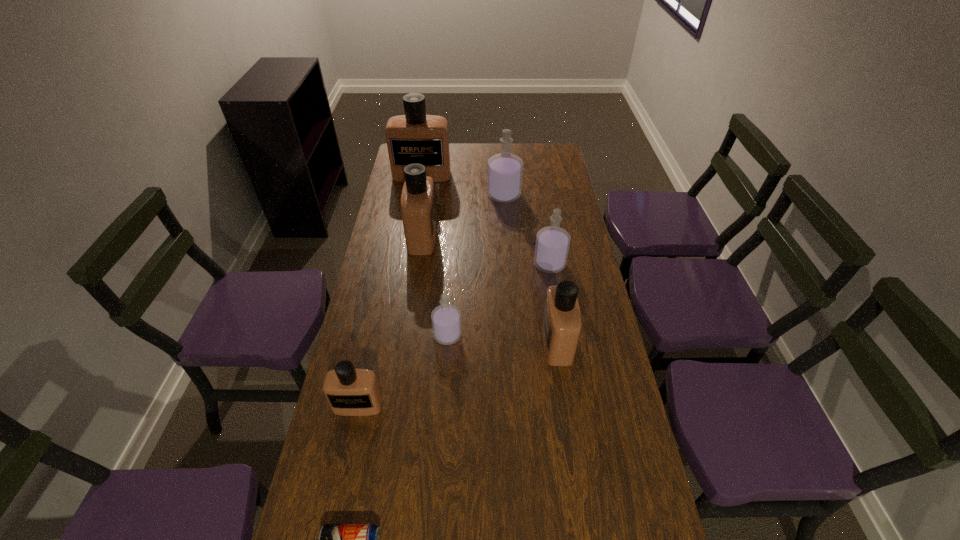
This screenshot has height=540, width=960. Find the location of `the smallest purple perfume`. the smallest purple perfume is located at coordinates (446, 319).

The image size is (960, 540). What are the coordinates of `the nearest perfume` in the screenshot? It's located at (350, 392).

The width and height of the screenshot is (960, 540). I want to click on the nearest beige perfume, so click(350, 392).

Find the location of a particular element. vacant space located on the front label of the farthest object is located at coordinates click(x=411, y=241).

What are the coordinates of `vacant space located 0.090m on the front label of the second biggest beige perfume` in the screenshot? It's located at (460, 237).

Where is `free region located on the back of the biggest purple perfume`? The width and height of the screenshot is (960, 540). free region located on the back of the biggest purple perfume is located at coordinates (503, 179).

Image resolution: width=960 pixels, height=540 pixels. Find the location of `vacant space located 0.050m on the front of the second nearest purple perfume`. vacant space located 0.050m on the front of the second nearest purple perfume is located at coordinates (553, 286).

This screenshot has height=540, width=960. I want to click on free space located 0.170m on the front label of the third farthest beige perfume, so click(x=487, y=342).

Locate an element on the screen. The image size is (960, 540). vacant space situated 0.100m on the front label of the third farthest beige perfume is located at coordinates (510, 342).

The height and width of the screenshot is (540, 960). In order to click on free space located on the front label of the third farthest beige perfume in this screenshot , I will do `click(442, 342)`.